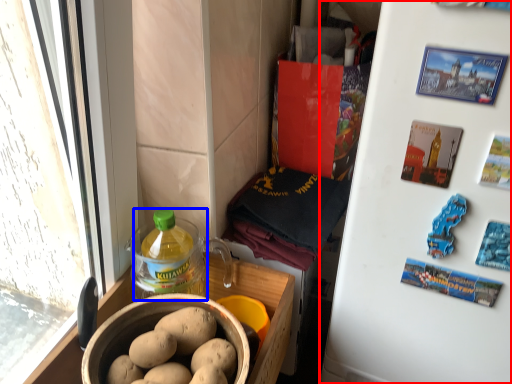
Question: Which of the following is the farthest to the observer, refrigerator (highlighted by a red box) or bottle (highlighted by a blue box)?

Choices:
 (A) refrigerator
 (B) bottle

Answer: (B)